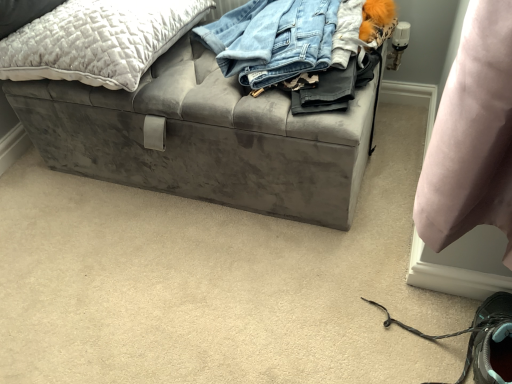
Describe the element at coordinates (98, 41) in the screenshot. The height and width of the screenshot is (384, 512). I see `quilted gray pillow at upper left` at that location.

From the picture: Measure the distance between point (115,57) and camera.

They are 3.37 feet apart.

You are a GUI agent. You are given a task and a screenshot of the screen. Output one action in this format:
    pyautogui.click(x=<x>, y=<y>)
    Task: Click on the gray suede shoe at lower right
    
    Given the screenshot: What is the action you would take?
    pyautogui.click(x=480, y=339)

Find the location of `quilted gray pillow at upper left`. quilted gray pillow at upper left is located at coordinates (98, 41).

Is gray suede shoe at lower right to the left of velvet gray storage bench at center from the viewer's perspective?

In fact, gray suede shoe at lower right is to the right of velvet gray storage bench at center.

Is gray suede shoe at lower right wider or thinner than velvet gray storage bench at center?

Clearly, gray suede shoe at lower right has less width compared to velvet gray storage bench at center.

Based on the photo, is gray suede shoe at lower right turned away from velvet gray storage bench at center?

No, gray suede shoe at lower right is not facing away from velvet gray storage bench at center.

Is quilted gray pillow at upper left not near velvet gray storage bench at center?

No, there isn't a large distance between quilted gray pillow at upper left and velvet gray storage bench at center.

From the image's perspective, is quilted gray pillow at upper left located above velvet gray storage bench at center?

Yes, from the image's perspective, quilted gray pillow at upper left is above velvet gray storage bench at center.

Does quilted gray pillow at upper left turn towards velvet gray storage bench at center?

No, quilted gray pillow at upper left is not facing towards velvet gray storage bench at center.

Is velvet gray storage bench at center outside of gray suede shoe at lower right?

Yes, velvet gray storage bench at center is not within gray suede shoe at lower right.

Considering the relative sizes of velvet gray storage bench at center and gray suede shoe at lower right in the image provided, is velvet gray storage bench at center taller than gray suede shoe at lower right?

Yes, velvet gray storage bench at center is taller than gray suede shoe at lower right.

Between point (160, 92) and point (500, 348), which one is positioned behind?

The point (160, 92) is behind.

Does velvet gray storage bench at center appear on the left side of gray suede shoe at lower right?

Indeed, velvet gray storage bench at center is positioned on the left side of gray suede shoe at lower right.

I want to click on shoe located in front of the quilted gray pillow at upper left, so click(x=480, y=339).

Which is farther, (80, 32) or (490, 326)?

The point (80, 32) is more distant.

Is quilted gray pillow at upper left facing towards gray suede shoe at lower right?

No, quilted gray pillow at upper left is not facing towards gray suede shoe at lower right.

From the image's perspective, which one is positioned lower, quilted gray pillow at upper left or gray suede shoe at lower right?

gray suede shoe at lower right, from the image's perspective.

Who is taller, gray suede shoe at lower right or quilted gray pillow at upper left?

Standing taller between the two is gray suede shoe at lower right.

Who is bigger, gray suede shoe at lower right or quilted gray pillow at upper left?

quilted gray pillow at upper left is bigger.

This screenshot has width=512, height=384. Find the location of `shoe in front of the quilted gray pillow at upper left`. shoe in front of the quilted gray pillow at upper left is located at coordinates (480, 339).

This screenshot has height=384, width=512. In order to click on furniture below the quilted gray pillow at upper left (from a real-world perspective) in this screenshot , I will do `click(204, 139)`.

Which is closer to the camera, (x=358, y=100) or (x=6, y=58)?

Point (x=358, y=100) is positioned closer to the camera compared to point (x=6, y=58).

From the image's perspective, is velvet gray storage bench at center beneath quilted gray pillow at upper left?

Yes.

Which of these two, velvet gray storage bench at center or quilted gray pillow at upper left, is wider?

velvet gray storage bench at center is wider.

Locate an element on the screen. The height and width of the screenshot is (384, 512). furniture that is above the gray suede shoe at lower right (from a real-world perspective) is located at coordinates (204, 139).

In the image, there is a velvet gray storage bench at center. Find the location of `pillow above it (from the image's perspective)`. pillow above it (from the image's perspective) is located at coordinates (98, 41).

Based on their spatial positions, is gray suede shoe at lower right or velvet gray storage bench at center closer to quilted gray pillow at upper left?

velvet gray storage bench at center is closer to quilted gray pillow at upper left.

Estimate the real-world distances between objects in this image. Which object is closer to velvet gray storage bench at center, quilted gray pillow at upper left or gray suede shoe at lower right?

The object closer to velvet gray storage bench at center is quilted gray pillow at upper left.

When comparing their distances from velvet gray storage bench at center, does gray suede shoe at lower right or quilted gray pillow at upper left seem further?

Based on the image, gray suede shoe at lower right appears to be further to velvet gray storage bench at center.

Which object lies further to the anchor point gray suede shoe at lower right, velvet gray storage bench at center or quilted gray pillow at upper left?

Answer: Based on the image, quilted gray pillow at upper left appears to be further to gray suede shoe at lower right.

Consider the image. When comparing their distances from gray suede shoe at lower right, does quilted gray pillow at upper left or velvet gray storage bench at center seem closer?

Based on the image, velvet gray storage bench at center appears to be nearer to gray suede shoe at lower right.

When comparing their distances from quilted gray pillow at upper left, does velvet gray storage bench at center or gray suede shoe at lower right seem further?

gray suede shoe at lower right lies further to quilted gray pillow at upper left than the other object.

This screenshot has width=512, height=384. What are the coordinates of `furniture between quilted gray pillow at upper left and gray suede shoe at lower right in the horizontal direction` in the screenshot? It's located at (204, 139).